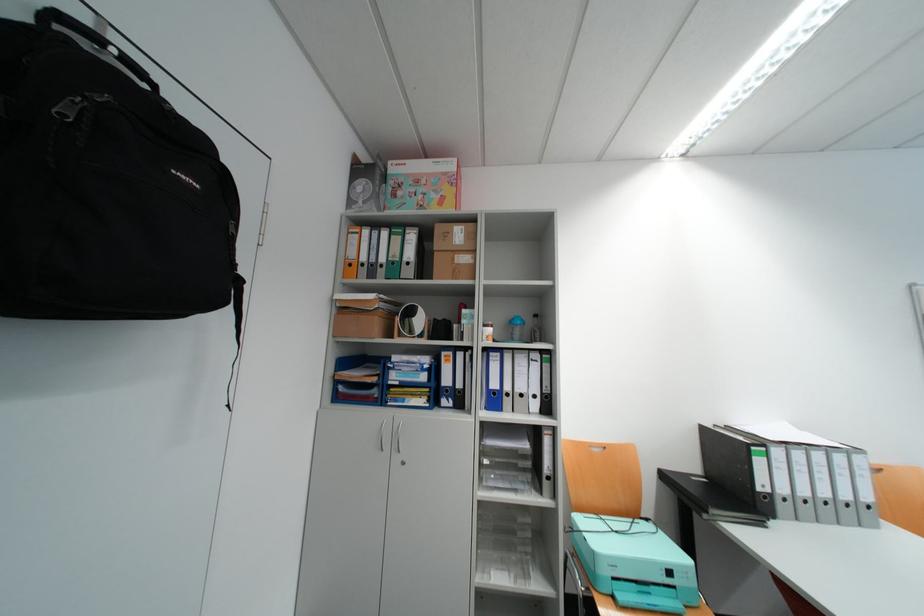
Where would you pull the orange binder spine hole? Please return your answer as a coordinate pair (x, y).

(349, 265)